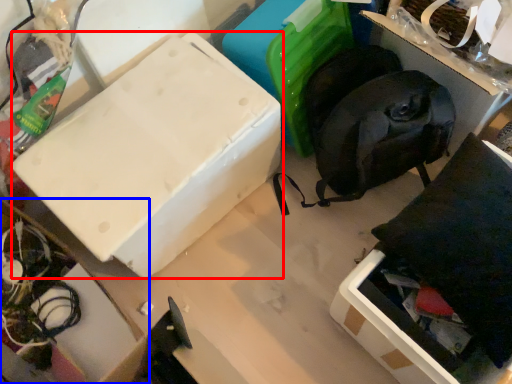
Question: Which of the following is the closest to the observer, box (highlighted by a red box) or cardboard box (highlighted by a blue box)?

Choices:
 (A) box
 (B) cardboard box

Answer: (B)